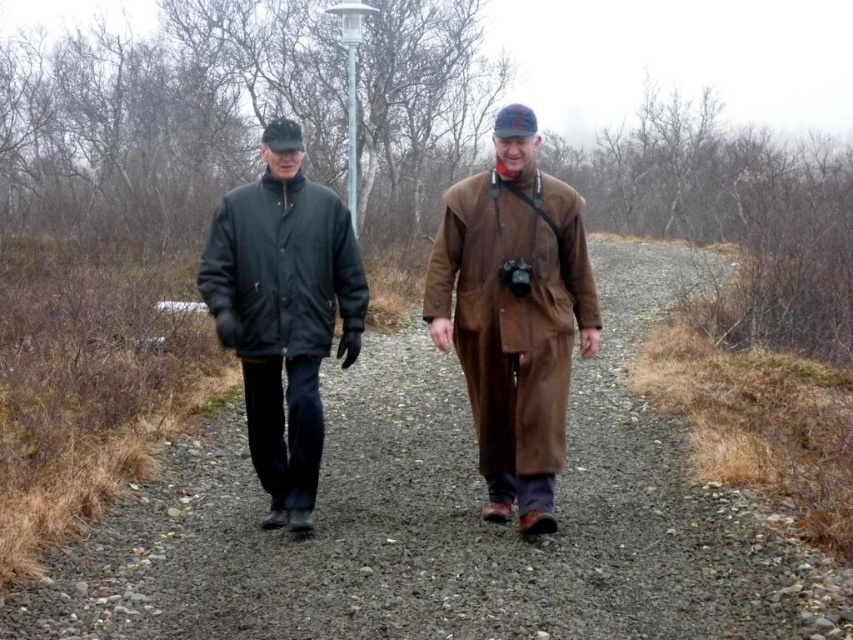
Question: Among these points, which one is nearest to the camera?

Choices:
 (A) 608,483
 (B) 569,248
 (C) 300,144

Answer: (C)

Question: Can you confirm if brown leather coat at center is positioned below matte black jacket at left?

Choices:
 (A) yes
 (B) no

Answer: (B)

Question: Based on their relative distances, which object is farther from the brown leather coat at center?

Choices:
 (A) matte black jacket at left
 (B) matte black jacket at center

Answer: (B)

Question: Where is matte black jacket at center located in relation to brown leather coat at center in the image?

Choices:
 (A) above
 (B) below

Answer: (B)

Question: Does matte black jacket at center have a larger size compared to brown leather coat at center?

Choices:
 (A) no
 (B) yes

Answer: (B)

Question: Considering the real-world distances, which object is farthest from the matte black jacket at left?

Choices:
 (A) brown leather coat at center
 (B) matte black jacket at center

Answer: (B)